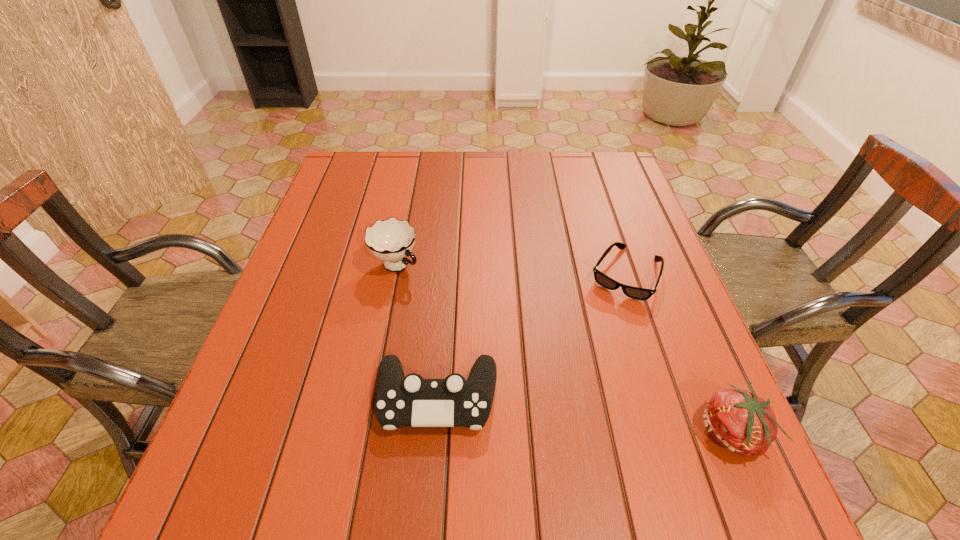
You are a GUI agent. You are given a task and a screenshot of the screen. Output one action in this format:
    pyautogui.click(x=<x>, y=<y>)
    Task: Click on the free space on the desktop that is between the control and the tomato and is positioned on the side of the cup with the handle
    The width and height of the screenshot is (960, 540).
    Given the screenshot: What is the action you would take?
    pyautogui.click(x=598, y=417)

Find the location of a particular element. Image resolution: width=960 pixels, height=540 pixels. free spot on the desktop that is between the control and the tomato and is positioned on the front-facing side of the sunglasses is located at coordinates (554, 412).